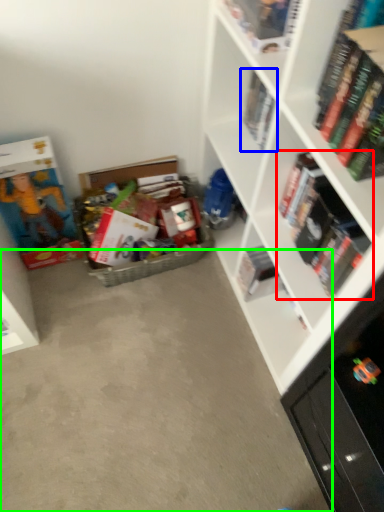
Question: Which object is positioned farthest from book (highlighted by a red box)? Select from book (highlighted by a blue box) and concrete (highlighted by a green box).

Choices:
 (A) book
 (B) concrete

Answer: (B)